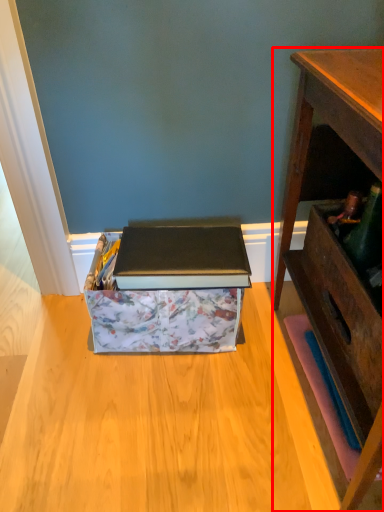
Question: Considering the relative positions of desk (annotated by the red box) and cardboard box in the image provided, where is desk (annotated by the red box) located with respect to the staircase?

Choices:
 (A) right
 (B) left

Answer: (A)